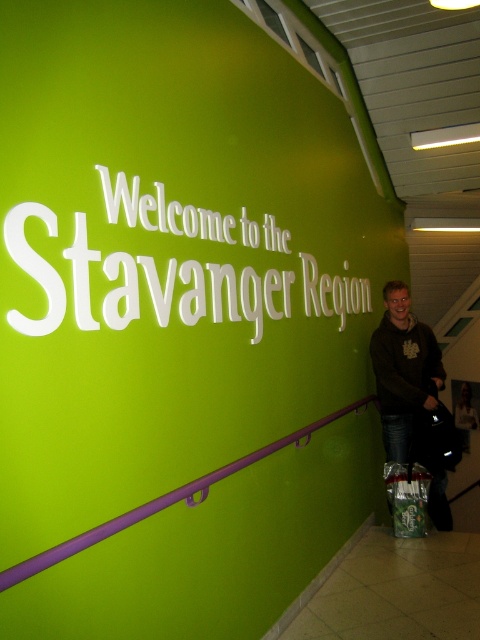
You are standing in front of the green wall with the white sign. There is a point marked at coordinates (171, 289). Which object does this point lie on?

The point marked at coordinates (171, 289) lies on the white matte sign at upper center.

You are standing in front of the green wall with the text. There is a point at coordinates (404,371). What object is located at this point?

The dark brown sweater at lower right is located at point (404,371).

You are standing at the purple handrail along the lower edge of the wall. You notice two points marked on the wall. The first point is at coordinate point (440, 486) and the second is at point (458, 384). If you want to touch the point that is closer to you, which coordinate should you reach for?

Point (440, 486) is in front of point (458, 384), so you should reach for point (440, 486) as it is closer to you.